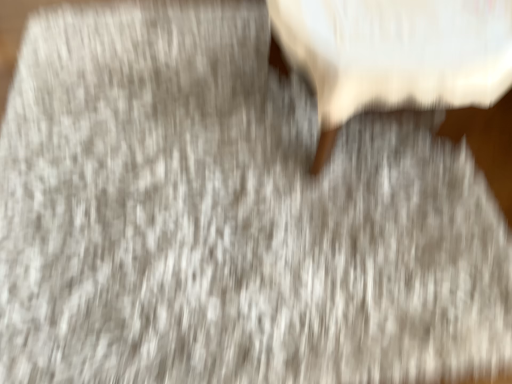
Image resolution: width=512 pixels, height=384 pixels. What do you see at coordinates (396, 54) in the screenshot?
I see `white fabric cushion at upper right` at bounding box center [396, 54].

Locate an element on the screen. The height and width of the screenshot is (384, 512). white fabric cushion at upper right is located at coordinates (396, 54).

You are a GUI agent. You are given a task and a screenshot of the screen. Output one action in this format:
    pyautogui.click(x=<x>, y=<y>)
    Task: Click on the white fabric cushion at upper right
    The height and width of the screenshot is (384, 512).
    Given the screenshot: What is the action you would take?
    pyautogui.click(x=396, y=54)